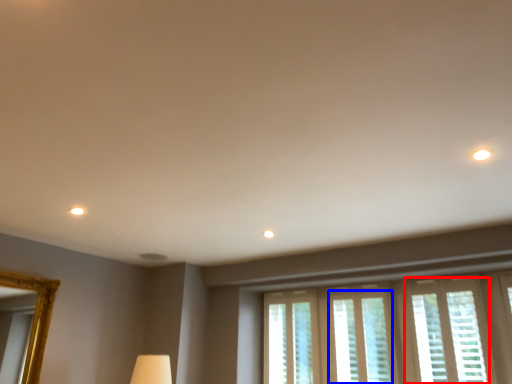
Question: Among these objects, which one is farthest to the camera, window (highlighted by a red box) or window (highlighted by a blue box)?

Choices:
 (A) window
 (B) window

Answer: (B)